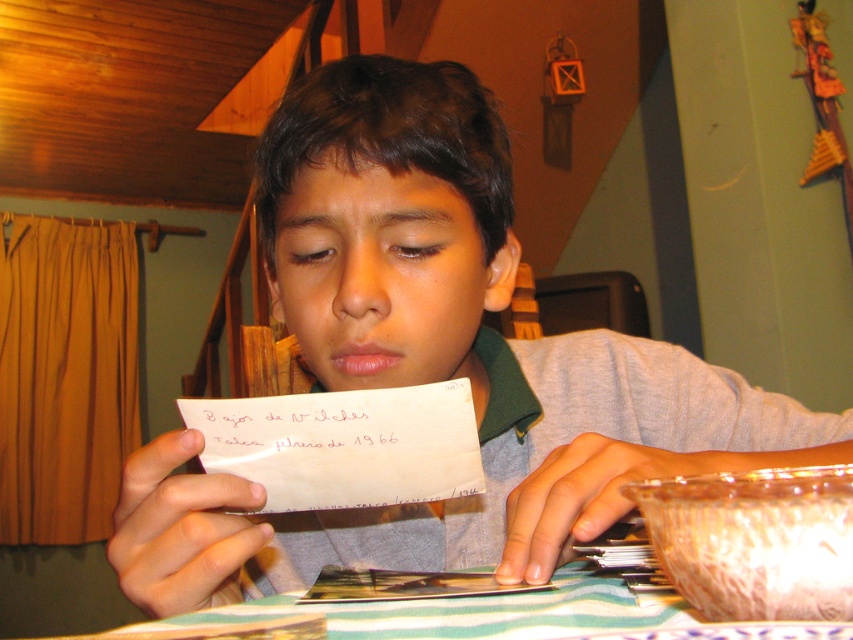
Who is positioned more to the left, white paper at center or black paper at center?

white paper at center is more to the left.

Who is more distant from viewer, [476,458] or [187,413]?

The point [476,458] is behind.

Is point (329, 401) farther from viewer compared to point (248, 422)?

No, it is in front of (248, 422).

Locate an element on the screen. This screenshot has height=640, width=853. white paper at center is located at coordinates (344, 444).